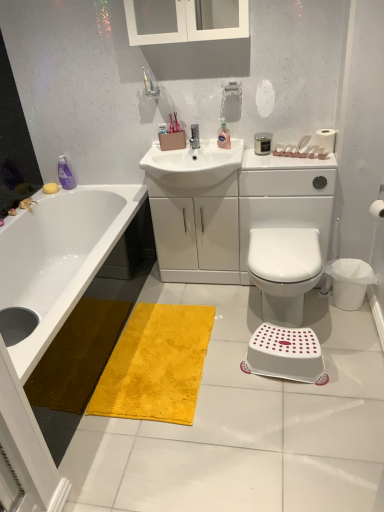
The height and width of the screenshot is (512, 384). In order to click on free space on the front side of translucent plastic soap dispenser at upper center, acting as the 2th toiletry starting from the left in this screenshot , I will do `click(235, 149)`.